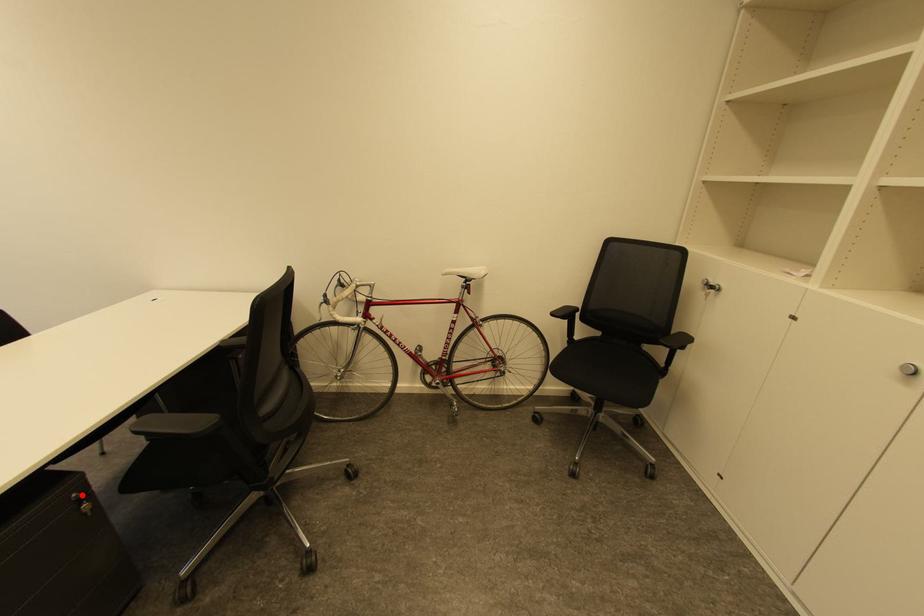
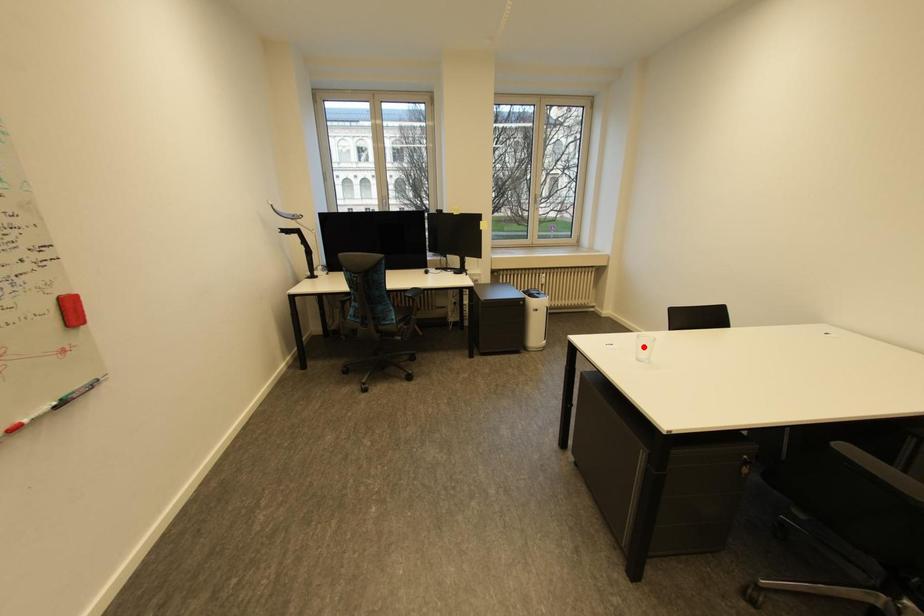
I am providing you with two images of the same scene from different viewpoints. A red point is marked on the first image and another point is marked on the second image. Is the marked point in image1 the same physical position as the marked point in image2?

No